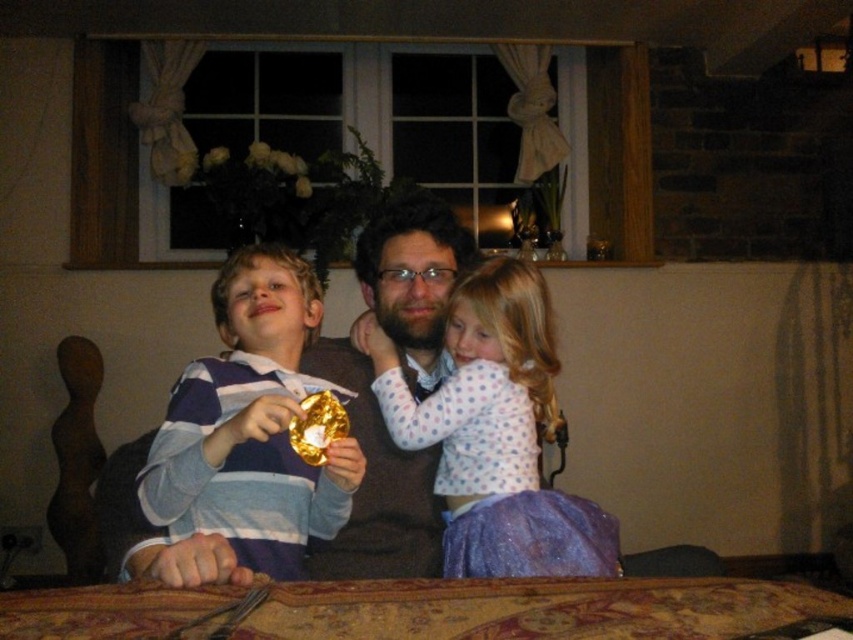
Can you confirm if wooden table at center is positioned to the left of striped fabric shirt at left?

No, wooden table at center is not to the left of striped fabric shirt at left.

Is wooden table at center smaller than striped fabric shirt at left?

Indeed, wooden table at center has a smaller size compared to striped fabric shirt at left.

Describe the element at coordinates (425, 611) in the screenshot. I see `wooden table at center` at that location.

At what (x,y) coordinates should I click in order to perform the action: click on wooden table at center. Please return your answer as a coordinate pair (x, y). This screenshot has height=640, width=853. Looking at the image, I should click on (425, 611).

Does point (294, 516) come in front of point (489, 346)?

Yes, point (294, 516) is in front of point (489, 346).

Is striped fabric shirt at left above purple glitter dress at center?

Indeed, striped fabric shirt at left is positioned over purple glitter dress at center.

At what (x,y) coordinates should I click in order to perform the action: click on striped fabric shirt at left. Please return your answer as a coordinate pair (x, y). The image size is (853, 640). Looking at the image, I should click on (251, 426).

Is the position of wooden table at center more distant than that of purple glitter dress at center?

No, it is not.

Which is below, wooden table at center or purple glitter dress at center?

wooden table at center

This screenshot has width=853, height=640. Identify the location of wooden table at center. pyautogui.click(x=425, y=611).